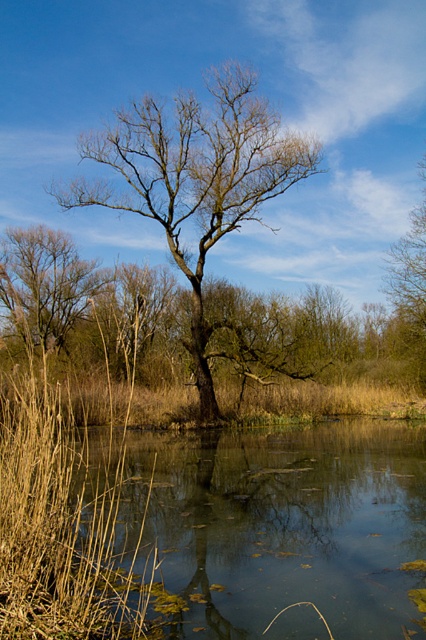
Question: Which object appears closest to the camera in this image?

Choices:
 (A) brown matte tree at upper right
 (B) brown grass at left
 (C) greenish reflective water at lower center

Answer: (B)

Question: Which object appears farthest from the camera in this image?

Choices:
 (A) greenish reflective water at lower center
 (B) brown matte tree at upper right
 (C) brown grass at left
 (D) bare wood tree at center

Answer: (B)

Question: Among these objects, which one is farthest from the camera?

Choices:
 (A) bare wood tree at center
 (B) brown matte tree at upper right

Answer: (B)

Question: Where is brown grass at left located in relation to bare wood tree at center in the image?

Choices:
 (A) above
 (B) below

Answer: (B)

Question: Is brown grass at left above bare wood tree at center?

Choices:
 (A) no
 (B) yes

Answer: (A)

Question: Does greenish reflective water at lower center appear over brown matte tree at upper right?

Choices:
 (A) no
 (B) yes

Answer: (A)